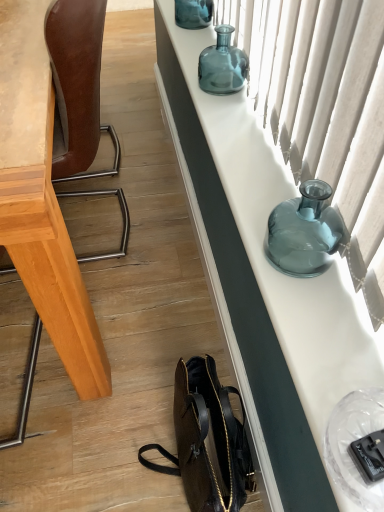
Where is `free space to the back side of translucent glass vase at upper center, which ranks as the 2th bottle in top-to-bottom order`? The width and height of the screenshot is (384, 512). free space to the back side of translucent glass vase at upper center, which ranks as the 2th bottle in top-to-bottom order is located at coordinates (216, 54).